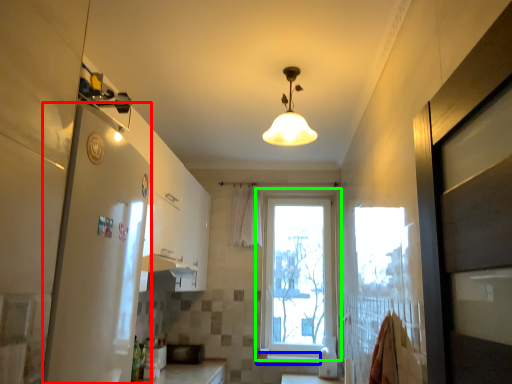
Question: Based on their relative distances, which object is nearer to screen door (highlighted by a red box)? Choose from window sill (highlighted by a blue box) and window (highlighted by a green box).

Choices:
 (A) window sill
 (B) window

Answer: (B)